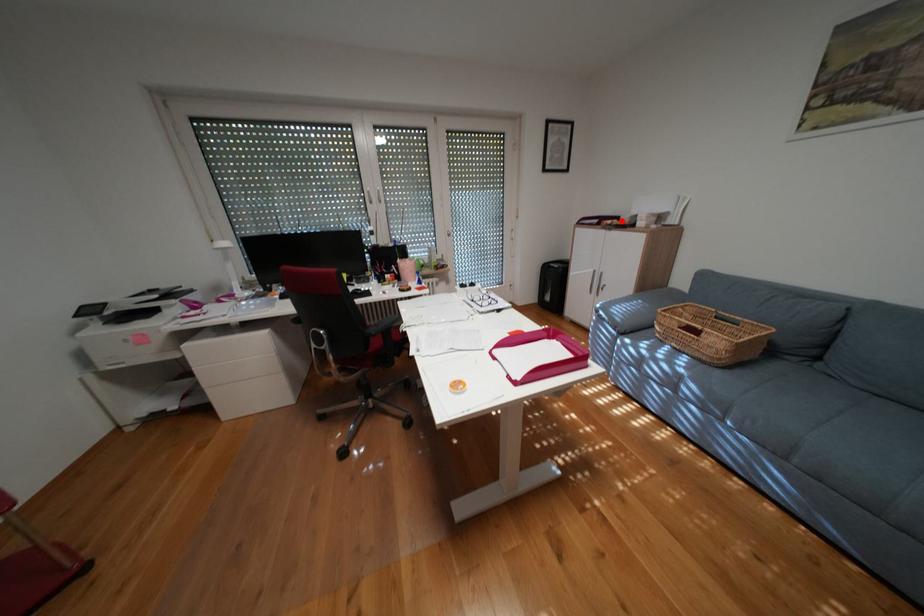
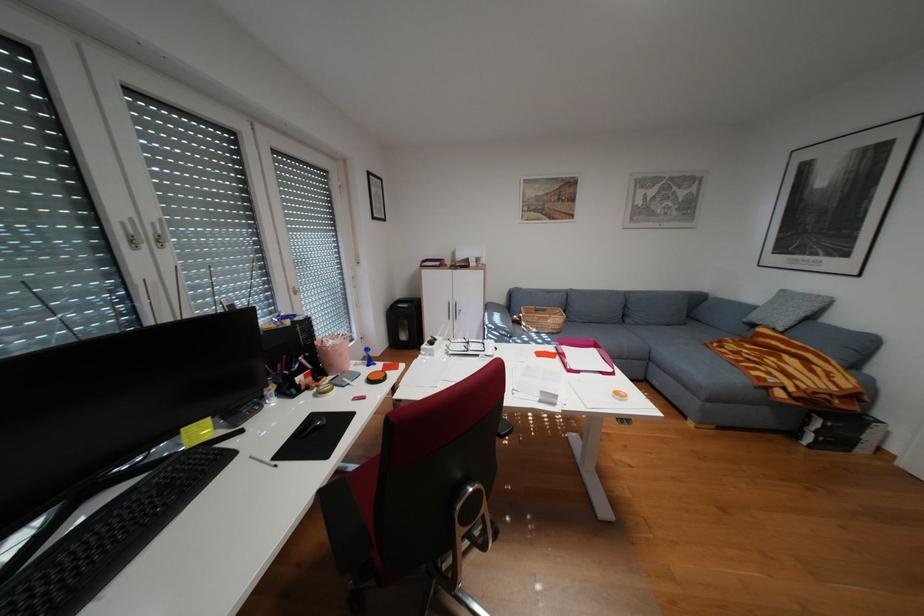
Find the pixel in the second image that matches the highlighted location in the first image.

(460, 262)